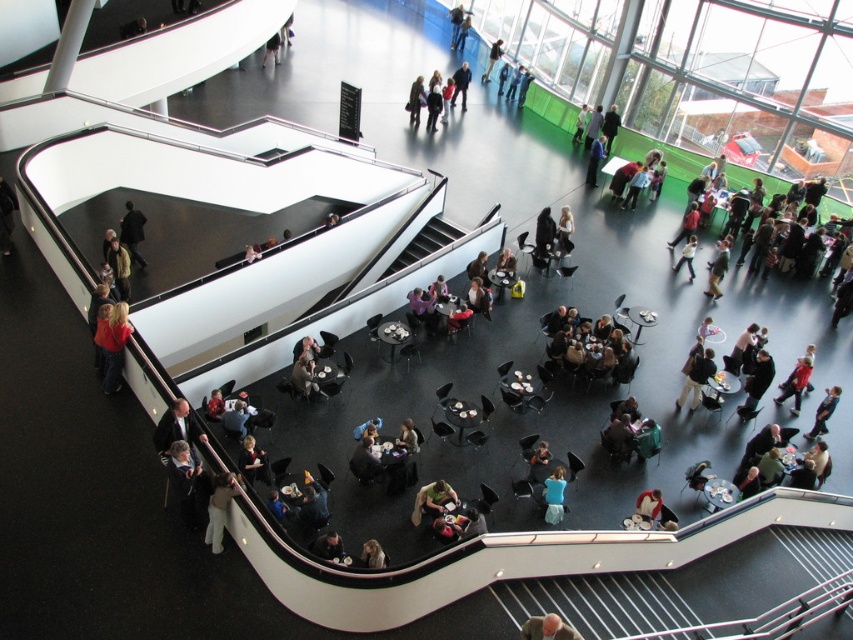
Question: From the image, what is the correct spatial relationship of dark brown leather chairs at center in relation to dark blue shirt at center?

Choices:
 (A) above
 (B) below

Answer: (B)

Question: Considering the real-world distances, which object is closest to the dark blue shirt at center?

Choices:
 (A) gray hair at lower center
 (B) matte red shirt at left
 (C) dark gray jacket at upper left

Answer: (C)

Question: Can you confirm if light beige pants at lower left is positioned to the right of blue fabric shirt at center?

Choices:
 (A) yes
 (B) no

Answer: (B)

Question: Which of the following is the farthest from the observer?

Choices:
 (A) gray hair at lower center
 (B) blue fabric shirt at center
 (C) dark blue shirt at center

Answer: (C)

Question: Observing the image, what is the correct spatial positioning of dark gray jacket at upper left in reference to light brown leather jacket at lower left?

Choices:
 (A) above
 (B) below

Answer: (A)

Question: Among these points, which one is farthest from the camera?

Choices:
 (A) click(x=467, y=65)
 (B) click(x=424, y=492)
 (C) click(x=119, y=232)
 (D) click(x=532, y=618)

Answer: (A)